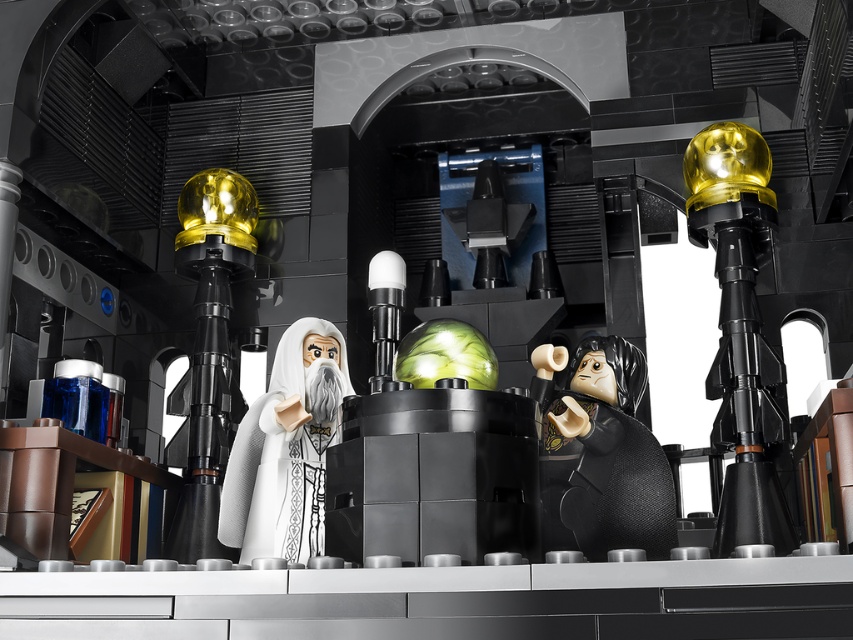
Question: Which point is closer to the camera?

Choices:
 (A) (592, 451)
 (B) (190, 547)
 (C) (711, 388)

Answer: (A)

Question: Is gold metallic sphere at right behind gold metallic sphere at left?

Choices:
 (A) yes
 (B) no

Answer: (B)

Question: Considering the real-world distances, which object is closest to the black matte figure at center?

Choices:
 (A) white matte wizard at center
 (B) gold metallic sphere at right

Answer: (B)

Question: Can you confirm if black matte figure at center is positioned to the right of white matte wizard at center?

Choices:
 (A) no
 (B) yes

Answer: (B)

Question: Among these objects, which one is nearest to the camera?

Choices:
 (A) black matte figure at center
 (B) white matte wizard at center

Answer: (A)

Question: Does gold metallic sphere at right come behind black matte figure at center?

Choices:
 (A) no
 (B) yes

Answer: (B)